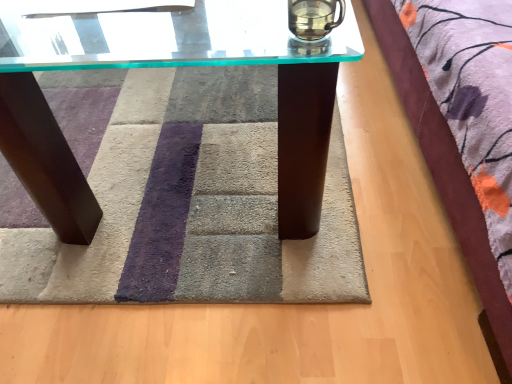
I want to click on transparent glass table at center, so click(167, 66).

Image resolution: width=512 pixels, height=384 pixels. What do you see at coordinates (167, 66) in the screenshot?
I see `transparent glass table at center` at bounding box center [167, 66].

What is the approximate width of transparent glass table at center?

transparent glass table at center is 1.37 meters wide.

Identify the location of transparent glass table at center. This screenshot has width=512, height=384. (167, 66).